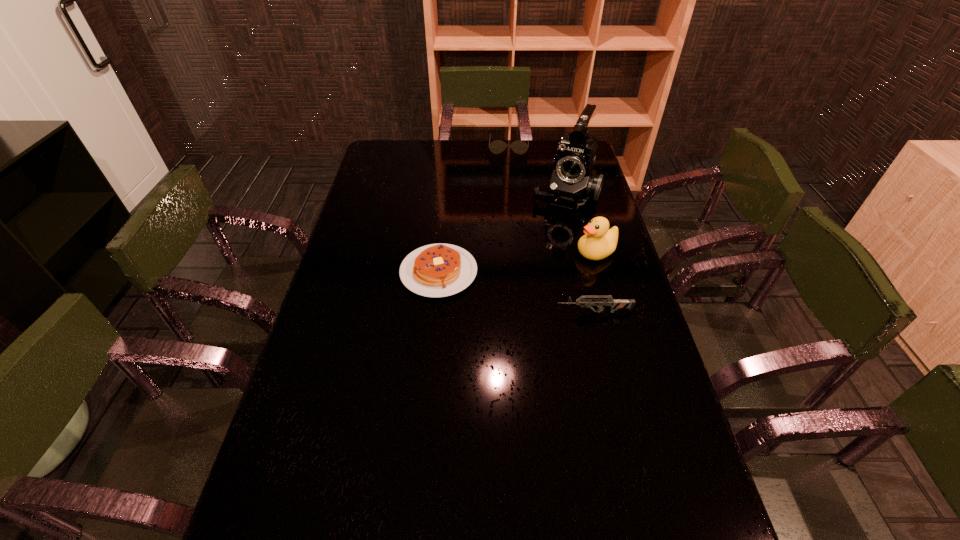
I want to click on vacant space located aimed along the barrel of the gun, so click(x=434, y=312).

At what (x,y) coordinates should I click in order to perform the action: click on free space located at the beak of the duck. Please return your answer as a coordinate pair (x, y). Looking at the image, I should click on (500, 286).

Where is `free point located 0.320m at the beak of the duck`? free point located 0.320m at the beak of the duck is located at coordinates (492, 289).

I want to click on vacant region located 0.080m at the beak of the duck, so click(559, 265).

Where is `free spot located on the lens mount of the second farthest object`? This screenshot has height=540, width=960. free spot located on the lens mount of the second farthest object is located at coordinates (x=551, y=223).

This screenshot has width=960, height=540. I want to click on free space located 0.390m on the lens mount of the second farthest object, so click(x=521, y=284).

Locate an element on the screen. free space located on the lens mount of the second farthest object is located at coordinates (532, 263).

Identify the location of free location located 0.140m on the front-facing side of the farthest object. (506, 173).

Where is `vacant space situated on the front-facing side of the farthest object`? vacant space situated on the front-facing side of the farthest object is located at coordinates point(503,212).

Identify the location of blank area located on the front-facing side of the farthest object. The height and width of the screenshot is (540, 960). (506, 170).